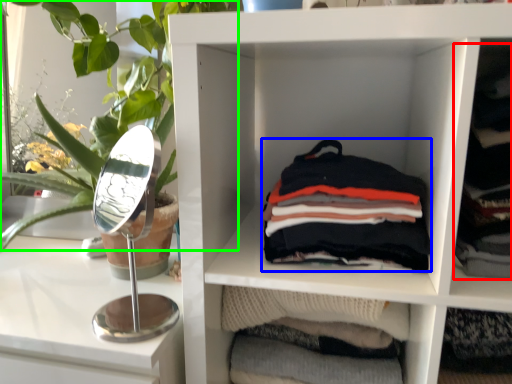
Question: Estimate the real-world distances between objects in this image. Which object is farther from clothing (highlighted by a red box), material (highlighted by a blue box) or plant (highlighted by a green box)?

Choices:
 (A) material
 (B) plant

Answer: (B)